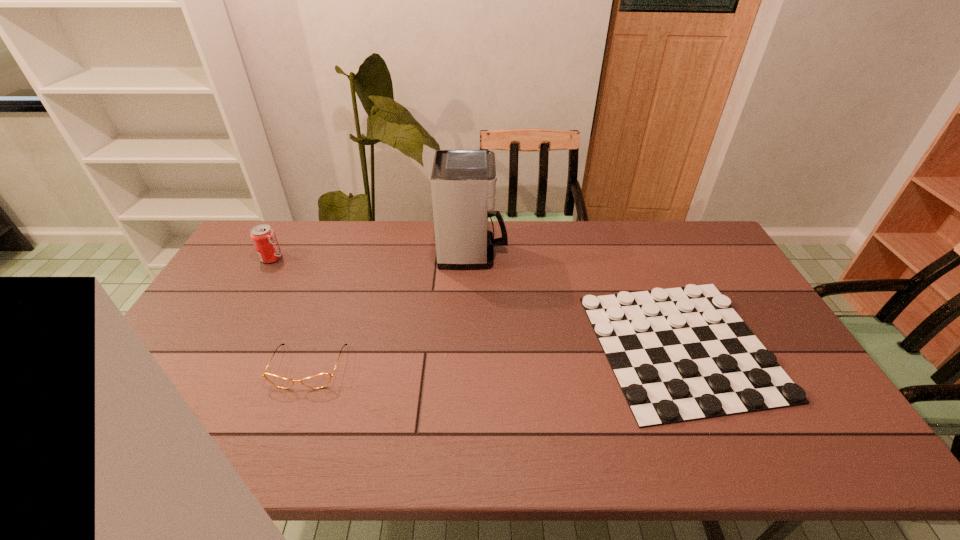
I want to click on vacant space situated on the front-facing side of the second shortest object, so click(x=293, y=411).

You are a GUI agent. You are given a task and a screenshot of the screen. Output one action in this format:
    pyautogui.click(x=<x>, y=<y>)
    Task: Click on the free location located on the left of the gameboard
    
    Given the screenshot: What is the action you would take?
    pyautogui.click(x=456, y=346)

Identify the location of coffee maker that is positioned at the far edge. (463, 182).

The height and width of the screenshot is (540, 960). Find the location of `soda can at the far edge`. soda can at the far edge is located at coordinates (264, 239).

This screenshot has height=540, width=960. I want to click on object that is at the near edge, so click(680, 354).

Locate an element on the screen. This screenshot has height=540, width=960. object located at the left edge is located at coordinates (264, 239).

The width and height of the screenshot is (960, 540). I want to click on object that is at the right edge, so click(680, 354).

Find the location of a particular element. Image resolution: width=960 pixels, height=540 pixels. object that is at the far left corner is located at coordinates (264, 239).

Where is `object located in the near right corner section of the desktop`? object located in the near right corner section of the desktop is located at coordinates (680, 354).

Image resolution: width=960 pixels, height=540 pixels. I want to click on free space at the far edge of the desktop, so coord(319,247).